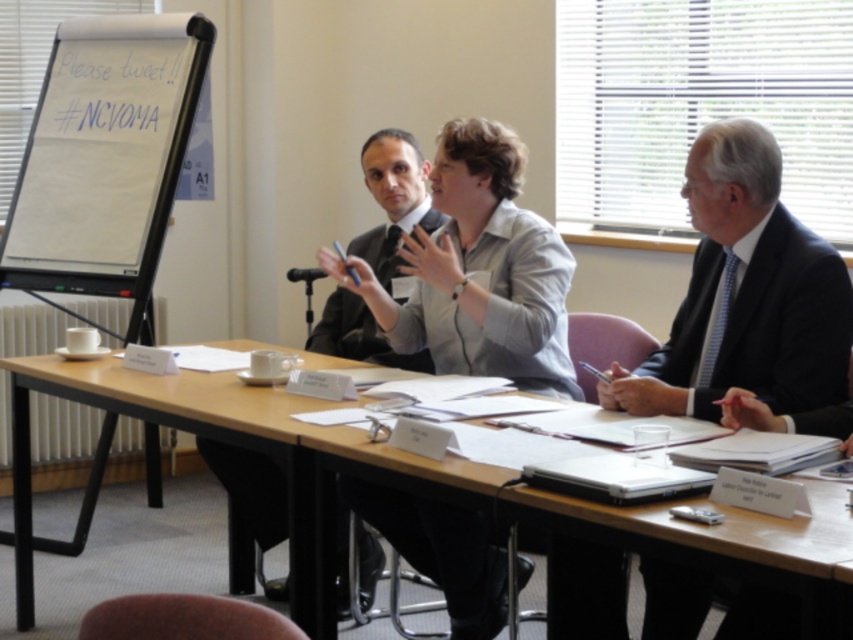
Question: Which object appears closest to the camera in this image?

Choices:
 (A) black plastic microphone at center
 (B) light gray shirt at center
 (C) dark gray suit at center
 (D) light brown wood table at center

Answer: (D)

Question: Can you confirm if dark gray suit at center is smaller than black plastic microphone at center?

Choices:
 (A) yes
 (B) no

Answer: (B)

Question: Is light brown wood table at center behind dark gray suit at center?

Choices:
 (A) no
 (B) yes

Answer: (A)

Question: Considering the real-world distances, which object is closest to the black plastic microphone at center?

Choices:
 (A) dark gray suit at center
 (B) light brown wood table at center

Answer: (A)

Question: Can you confirm if light gray shirt at center is positioned to the right of dark gray suit at center?

Choices:
 (A) yes
 (B) no

Answer: (A)

Question: Which object is closer to the camera taking this photo?

Choices:
 (A) black plastic microphone at center
 (B) light brown wood table at center
 (C) dark gray suit at center
 (D) light gray shirt at center

Answer: (B)